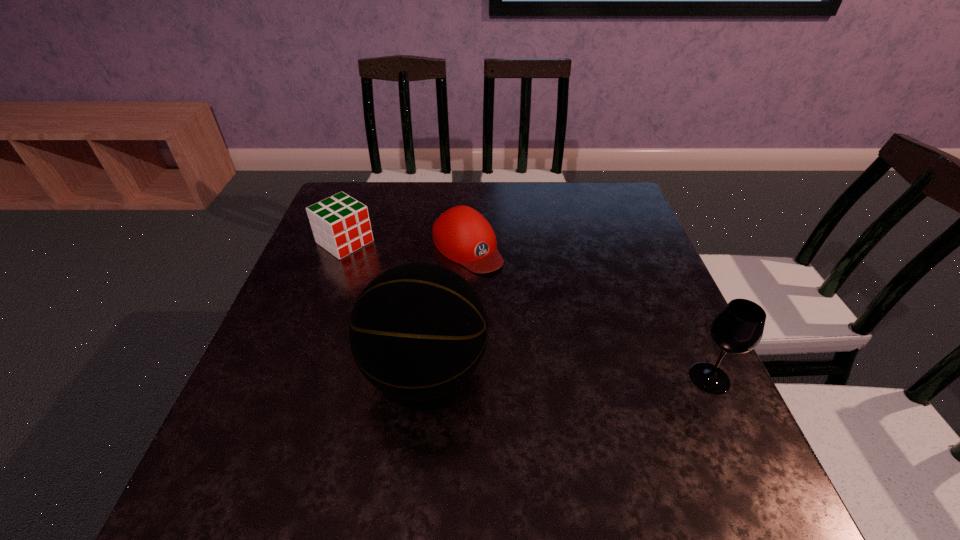
This screenshot has height=540, width=960. I want to click on vacant region at the near edge, so click(582, 408).

This screenshot has width=960, height=540. In order to click on vacant space at the left edge of the desktop in this screenshot , I will do `click(338, 267)`.

Where is `vacant area at the right edge of the desktop`? vacant area at the right edge of the desktop is located at coordinates (640, 373).

This screenshot has width=960, height=540. In the image, there is a desktop. Find the location of `vacant space at the far right corner`. vacant space at the far right corner is located at coordinates (587, 202).

You are a GUI agent. You are given a task and a screenshot of the screen. Output one action in this format:
    pyautogui.click(x=<x>, y=<y>)
    Task: Click on the free space between the baseball cap and the cube
    
    Given the screenshot: What is the action you would take?
    pyautogui.click(x=406, y=245)

Locate an element on the screen. free area in between the baseball cap and the cube is located at coordinates (406, 245).

This screenshot has width=960, height=540. Identify the location of free space between the leftmost object and the rightmost object. (527, 310).

Where is `vacant space that's between the tallest object and the wineglass`? vacant space that's between the tallest object and the wineglass is located at coordinates (567, 375).

Identify the location of free space between the leftmost object and the rightmost object. The height and width of the screenshot is (540, 960). (527, 310).

Identify which object is located as the second nearest to the third shortest object. Please provide its 2D coordinates. Your answer should be formatted as a tuple, i.e. [(x, y)], where the tuple contains the x and y coordinates of a point satisfying the conditions above.

[(461, 234)]